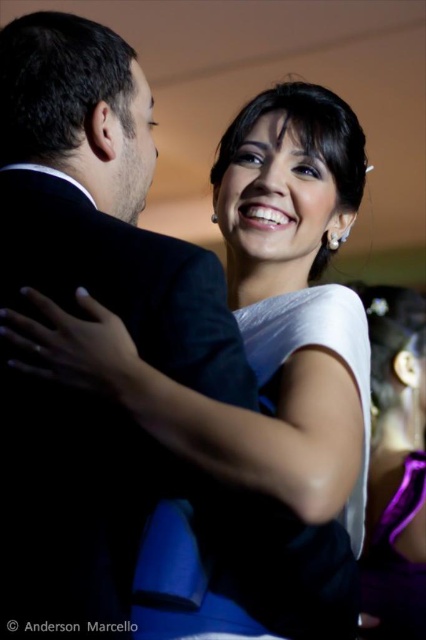
In the scene described, the black satin suit at center and the purple satin dress at lower right are part of the formal attire. Which piece of clothing is positioned to the left of the other?

The black satin suit at center is to the left of the purple satin dress at lower right.

Based on the photo, you are a photographer at a wedding reception. You need to place a decorative ribbon at the center of the black satin suit. The coordinates given are point (101,200). Is this point suitable for placing the ribbon?

Yes, the point (101,200) is on the black satin suit at center, so placing the ribbon there would be appropriate.

You are a photographer at a wedding reception and need to position two subjects in the frame. The black satin suit at center and the purple satin dress at lower right must be included. Which subject should you place higher in the frame to maintain their natural height as seen in the image?

The black satin suit at center should be placed higher in the frame since it is taller than the purple satin dress at lower right, maintaining their natural height as shown in the image.